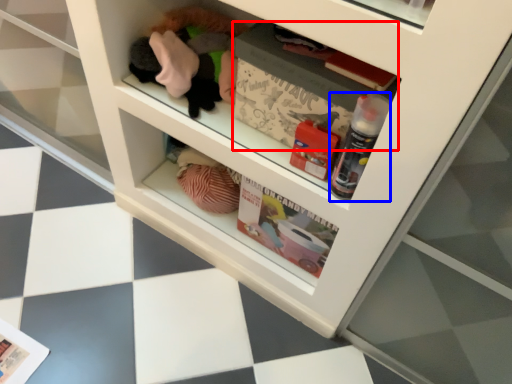
Question: Which of the following is the closest to the observer, magazine (highlighted by a red box) or bottle (highlighted by a blue box)?

Choices:
 (A) magazine
 (B) bottle

Answer: (B)